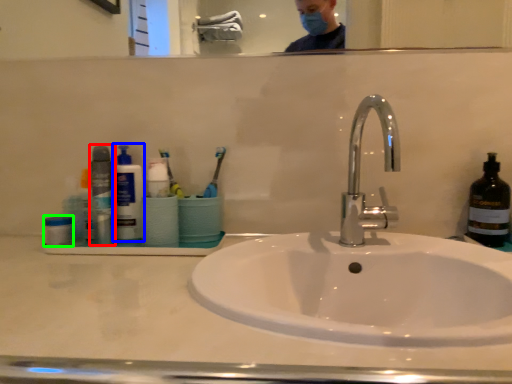
Question: Which object is positioned closest to bottle (highlighted by a red box)? Select from cleaning product (highlighted by a blue box) and mouthwash (highlighted by a green box).

Choices:
 (A) cleaning product
 (B) mouthwash

Answer: (A)